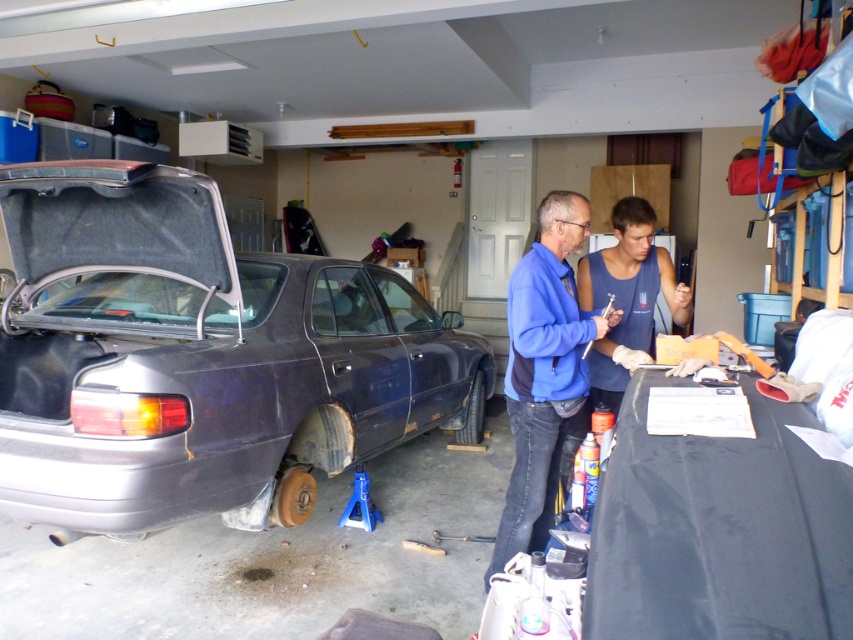
Question: Can you confirm if matte dark gray car at left is positioned to the right of blue fleece jacket at center?

Choices:
 (A) yes
 (B) no

Answer: (B)

Question: Which of the following is the closest to the observer?

Choices:
 (A) click(288, 307)
 (B) click(619, 371)

Answer: (B)

Question: Is matte dark gray car at left behind blue fleece jacket at center?

Choices:
 (A) yes
 (B) no

Answer: (B)

Question: Where is matte dark gray car at left located in relation to blue cotton tank top at center in the image?

Choices:
 (A) right
 (B) left

Answer: (B)

Question: Which object is closer to the camera taking this photo?

Choices:
 (A) matte dark gray car at left
 (B) blue cotton tank top at center
 (C) blue fleece jacket at center

Answer: (A)

Question: Which point is farther from the camera taking this photo?

Choices:
 (A) (300, 376)
 (B) (647, 253)

Answer: (A)